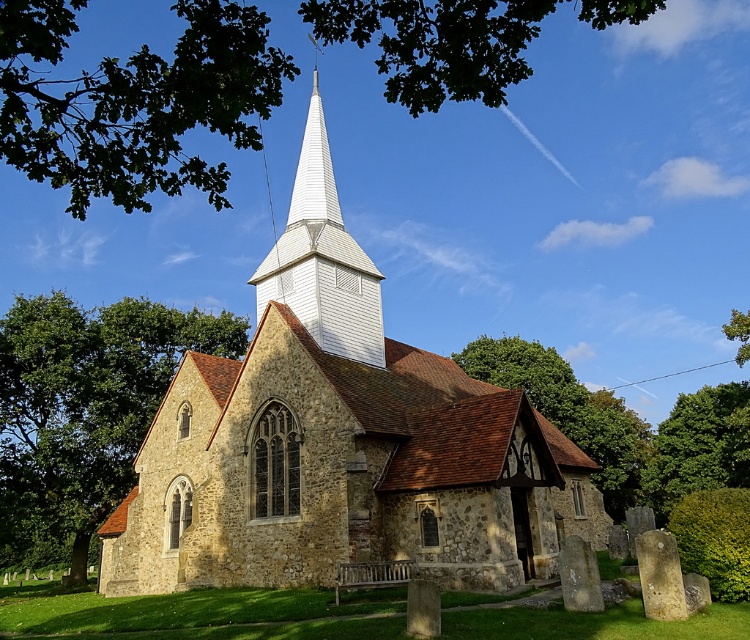
You are a landscape photographer planning to capture the stone church at center and the green leafy tree at upper right in a single frame. Based on their sizes, which object would appear smaller in the photo?

The stone church at center appears smaller in the photo because it has a lesser width compared to the green leafy tree at upper right.

Consider the image. You are standing in the churchyard and want to take a photo of the stone church at center and the green leafy tree at upper right. From your current position, which object is more to the left?

The stone church at center is more to the left because it is positioned on the left side of the green leafy tree at upper right.